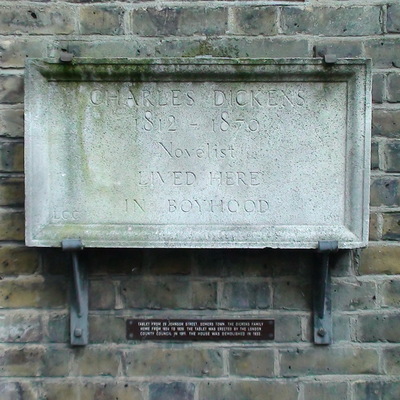
In order to click on brick wall in this screenshot , I will do `click(374, 303)`.